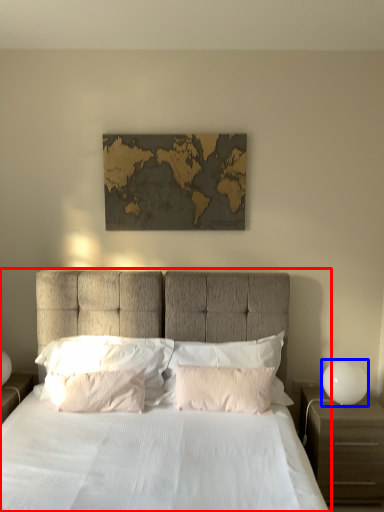
Question: Among these objects, which one is farthest to the camera, bed (highlighted by a red box) or bedside lamp (highlighted by a blue box)?

Choices:
 (A) bed
 (B) bedside lamp

Answer: (B)